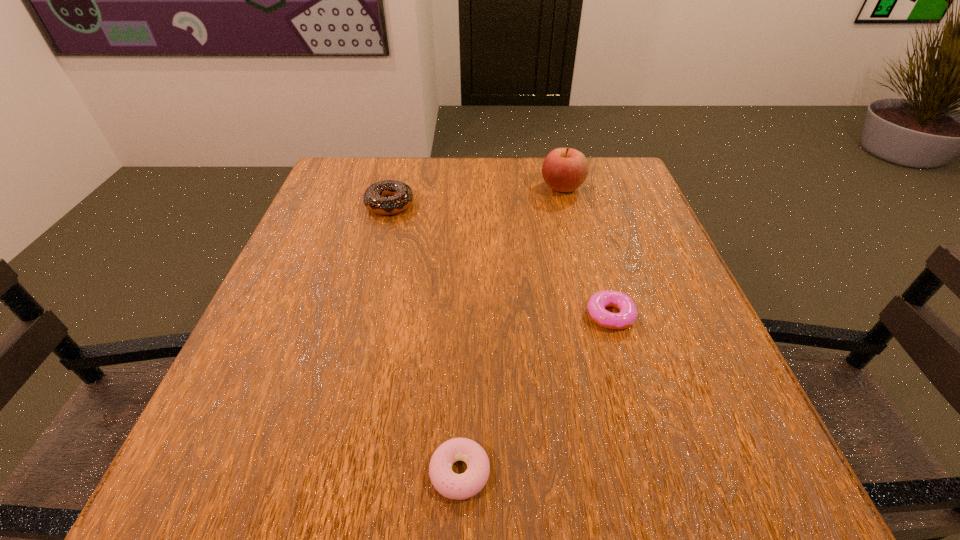
At what (x,y) coordinates should I click in order to perform the action: click on blank region between the tallest object and the second tallest object. Please return your answer as a coordinate pair (x, y). Looking at the image, I should click on (476, 196).

The width and height of the screenshot is (960, 540). Find the location of `vacant area between the farthest doughnut and the second doughnut from right to left`. vacant area between the farthest doughnut and the second doughnut from right to left is located at coordinates (425, 338).

Find the location of a particular element. The height and width of the screenshot is (540, 960). vacant area that lies between the nearest object and the tallest object is located at coordinates (511, 330).

Find the location of `free space between the tallest object and the third farthest object`. free space between the tallest object and the third farthest object is located at coordinates (587, 252).

Identify the location of vacant region between the nearest doughnut and the leftmost doughnut. (425, 338).

This screenshot has height=540, width=960. In order to click on vacant area that lies between the tallest doughnut and the tallest object in this screenshot , I will do `click(476, 196)`.

This screenshot has height=540, width=960. Identify the location of object that is the third nearest to the tallest object. [x=462, y=486].

Identify the location of the second closest object to the second nearest doughnut. (564, 169).

Locate an element on the screen. The width and height of the screenshot is (960, 540). doughnut that is the closest to the second object from left to right is located at coordinates pyautogui.click(x=597, y=303).

Locate which doughnut is the closest to the tallest object. Please provide its 2D coordinates. Your answer should be formatted as a tuple, i.e. [(x, y)], where the tuple contains the x and y coordinates of a point satisfying the conditions above.

[(388, 197)]